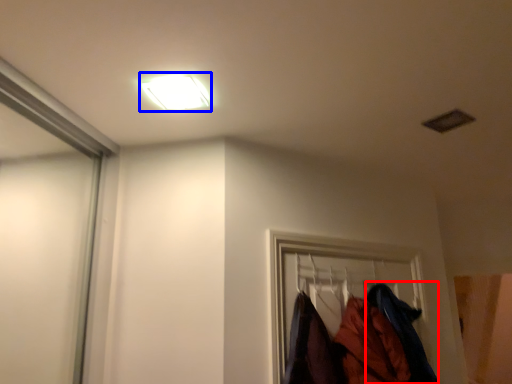
Question: Which point is further to the camera, clothing (highlighted by a red box) or lamp (highlighted by a blue box)?

Choices:
 (A) clothing
 (B) lamp

Answer: (A)